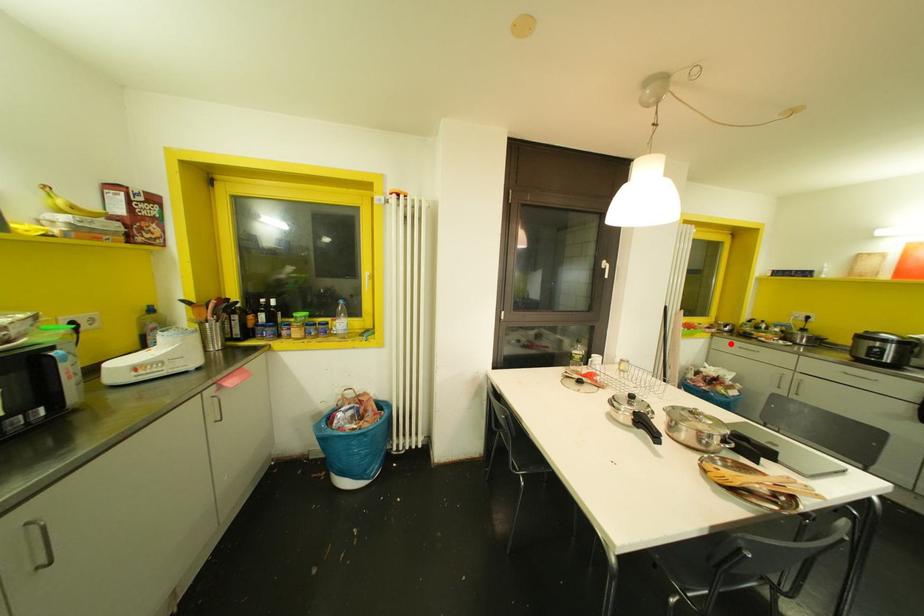
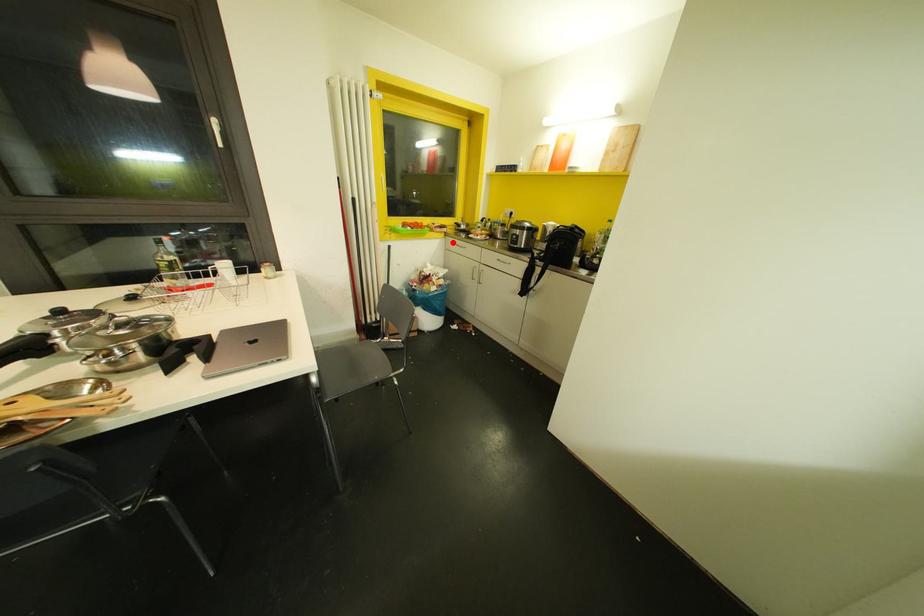
I am providing you with two images of the same scene from different viewpoints. A red point is marked on the first image and another point is marked on the second image. Are the points marked in image1 and image2 representing the same 3D position?

Yes